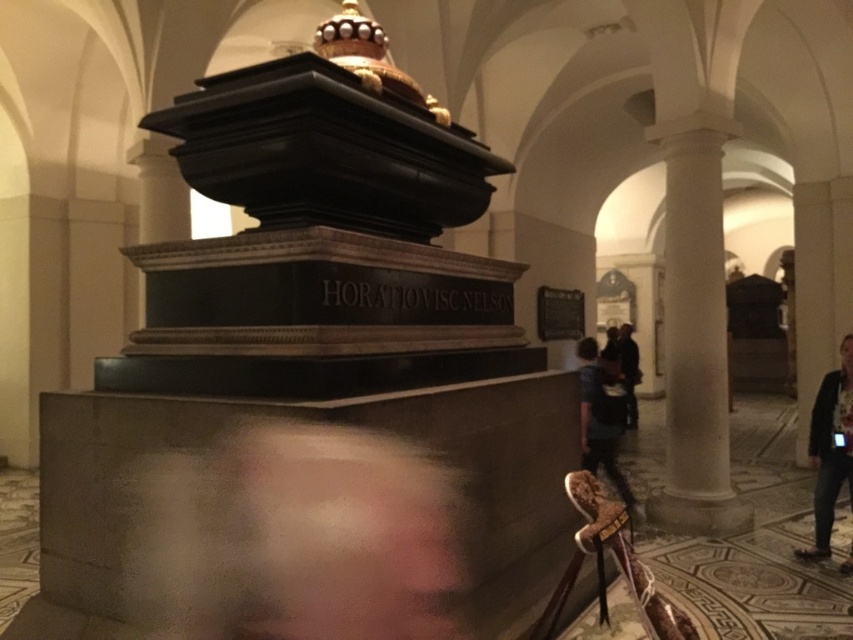
Question: Does jeans at lower right have a smaller size compared to black leather jacket at right?

Choices:
 (A) no
 (B) yes

Answer: (B)

Question: Which of the following is the farthest from the observer?

Choices:
 (A) black leather jacket at right
 (B) dark blue jeans at center
 (C) jeans at lower right

Answer: (A)

Question: Can you confirm if jeans at lower right is positioned below black leather jacket at right?

Choices:
 (A) yes
 (B) no

Answer: (A)

Question: Which point is closer to the camera?

Choices:
 (A) jeans at lower right
 (B) dark blue jeans at center

Answer: (A)

Question: Where is jeans at lower right located in relation to dark blue jeans at center in the image?

Choices:
 (A) above
 (B) below

Answer: (A)

Question: Which point is farther to the camera?

Choices:
 (A) black leather jacket at right
 (B) jeans at lower right

Answer: (A)